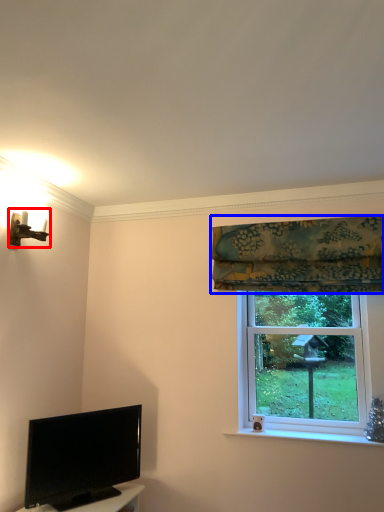
Question: Among these objects, which one is farthest to the camera, light fixture (highlighted by a red box) or curtain (highlighted by a blue box)?

Choices:
 (A) light fixture
 (B) curtain

Answer: (B)